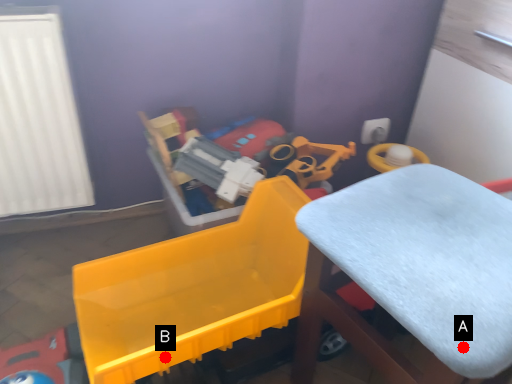
Question: Two points are circled on the image, labeled by A and B beside each circle. Which point is closer to the camera?

Choices:
 (A) A is closer
 (B) B is closer

Answer: (A)